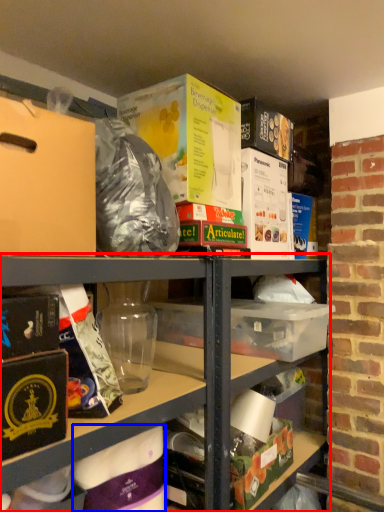
Question: Which object appears closest to the camera in this image, shelf (highlighted by a red box) or wrapping paper (highlighted by a blue box)?

Choices:
 (A) shelf
 (B) wrapping paper

Answer: (B)